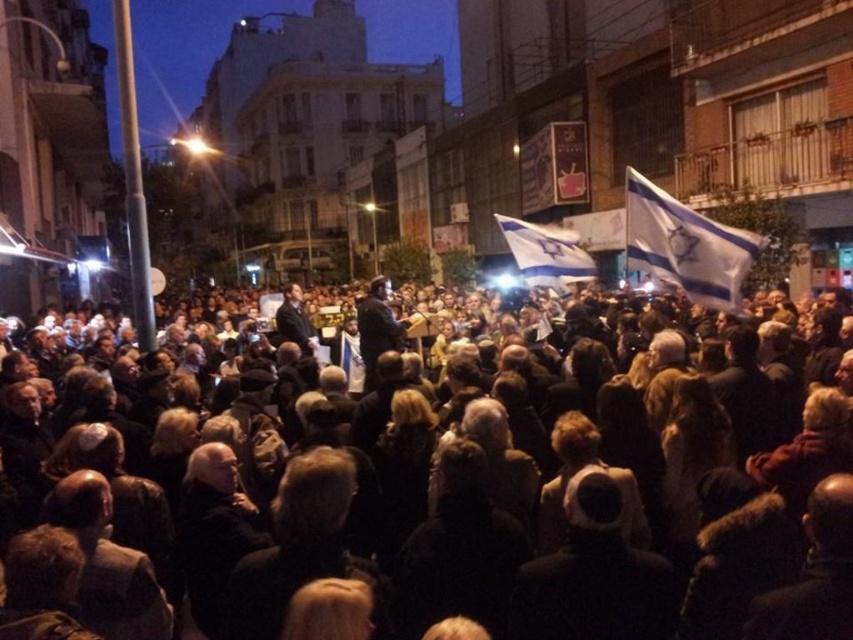
You are a photographer at the edge of the square and want to take a photo of the white fabric flag at center without the black fabric crowd at center blocking it. Is this possible given their positions?

The black fabric crowd at center is closer to the viewer than the white fabric flag at center, so the crowd will block the view of the flag. You cannot take a photo of the white fabric flag at center without the black fabric crowd at center blocking it.

You are a photographer trying to capture the speaker at the podium. You notice the black fabric crowd at center and the white fabric flag at upper right in your viewfinder. Which object takes up more horizontal space in the image?

The black fabric crowd at center takes up more horizontal space in the image because its width is larger than that of the white fabric flag at upper right.

You are standing at the front of the crowd in the public square and want to take a photo of the speaker. There is a point at coordinates point (44, 611) that you need to consider. Is this point close enough to capture a clear photo of the speaker?

The point at (44, 611) is 25.76 feet away from the camera. This distance may be sufficient to capture a clear photo of the speaker, depending on the camera quality and zoom capabilities.